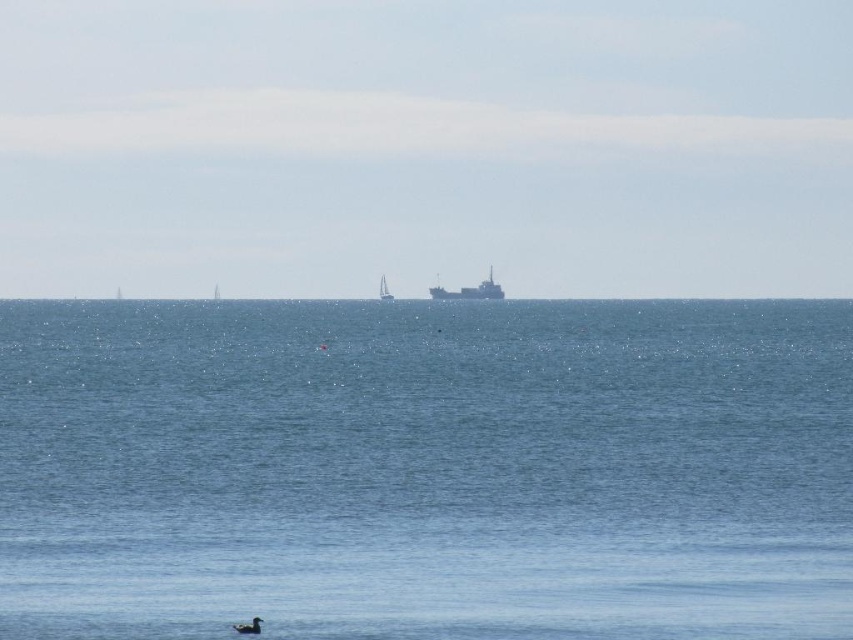
Question: Does blue water at center appear on the left side of metallic gray ship at center?

Choices:
 (A) yes
 (B) no

Answer: (A)

Question: Which of the following is the closest to the observer?

Choices:
 (A) metallic gray ship at center
 (B) blue water at center
 (C) white plastic sailboat at center

Answer: (B)

Question: Which of the following is the closest to the observer?

Choices:
 (A) blue water at center
 (B) white plastic sailboat at center

Answer: (A)

Question: Which point appears closest to the camera in this image?

Choices:
 (A) (436, 285)
 (B) (384, 280)

Answer: (A)

Question: Does blue water at center have a larger size compared to white plastic sailboat at center?

Choices:
 (A) yes
 (B) no

Answer: (A)

Question: Is metallic gray ship at center wider than white plastic sailboat at center?

Choices:
 (A) no
 (B) yes

Answer: (B)